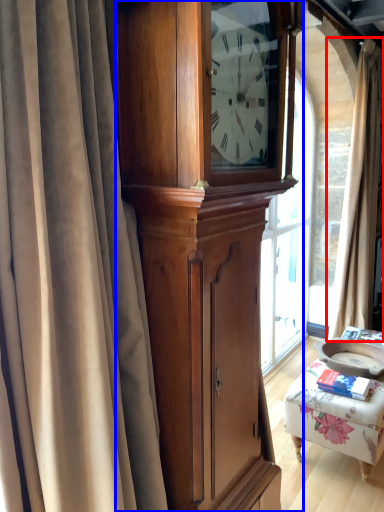
Question: Which object is further to the camera taking this photo, curtain (highlighted by a red box) or cabinetry (highlighted by a blue box)?

Choices:
 (A) curtain
 (B) cabinetry

Answer: (A)